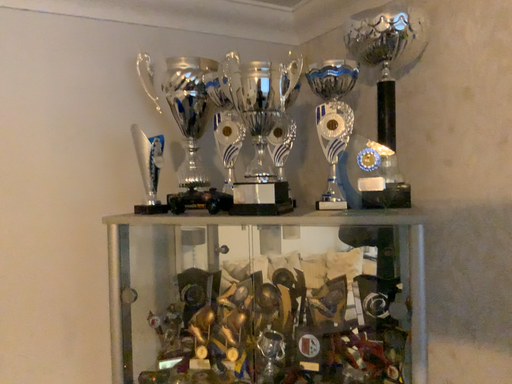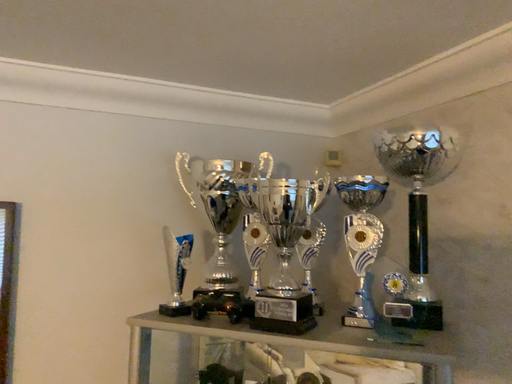
Question: Which way did the camera rotate in the video?

Choices:
 (A) rotated upward
 (B) rotated downward

Answer: (A)